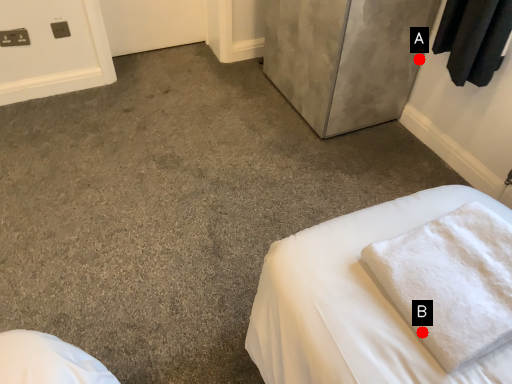
Question: Two points are circled on the image, labeled by A and B beside each circle. Which of the following is the closest to the observer?

Choices:
 (A) A is closer
 (B) B is closer

Answer: (B)